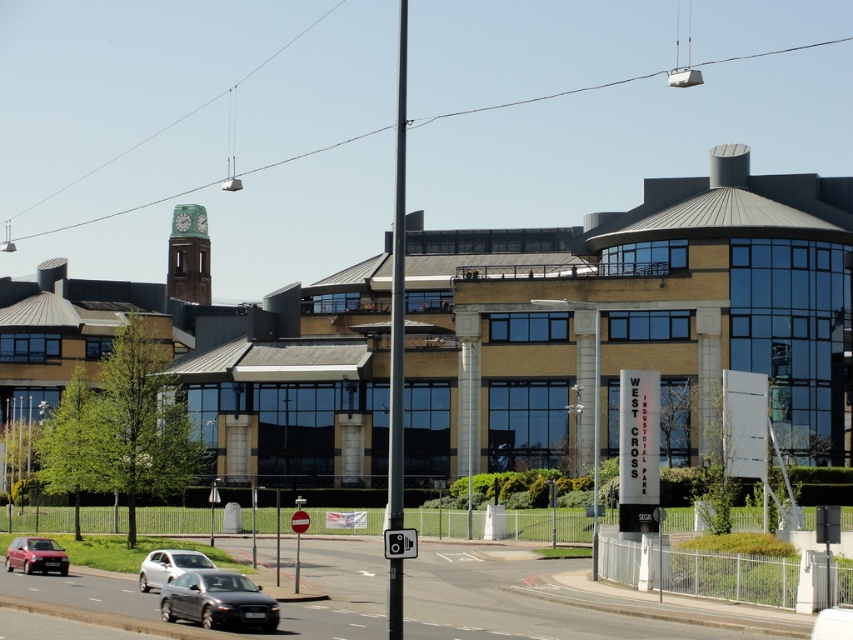
You are a delivery person needing to park your 15 feet long truck between the dark gray metallic car at lower center and the silver metallic hatchback at lower left. Can you fit your truck in that space?

The dark gray metallic car at lower center and silver metallic hatchback at lower left are 71.41 feet apart. Since your truck is 15 feet long, there is sufficient space to park between them as 71.41 feet is more than enough for the truck length.

You are standing at the entrance of the large building with a contemporary architectural design. You see a point marked at coordinate [218,600]. What object is located at that point?

The point at coordinate [218,600] indicates a dark gray metallic car at lower center.

You are a delivery driver who needs to park a silver metallic hatchback at lower left and a silver metallic sedan at lower left in the parking lot near the building. The parking spot has a height restriction of 1.5 meters. Which car will require more caution to park due to its height?

The silver metallic sedan at lower left is taller than the silver metallic hatchback at lower left. Since the parking spot has a height restriction of 1.5 meters, the silver metallic sedan at lower left may require more caution to park due to its greater height compared to the hatchback.